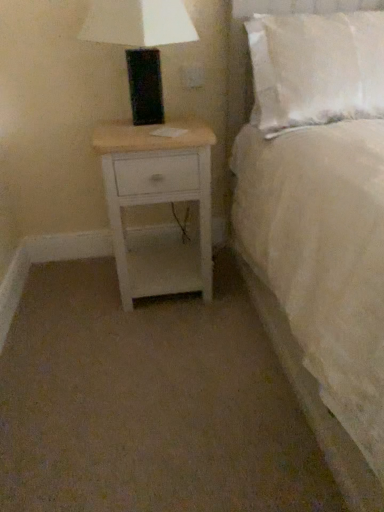
Identify the location of white soft pillow at upper right. Image resolution: width=384 pixels, height=512 pixels. coord(316,68).

You are a GUI agent. You are given a task and a screenshot of the screen. Output one action in this format:
    pyautogui.click(x=<x>, y=<y>)
    Task: Click on the white soft bed at upper right
    
    Given the screenshot: What is the action you would take?
    pyautogui.click(x=267, y=262)

Locate an element on the screen. This screenshot has width=384, height=512. white wood nightstand at lower left is located at coordinates (158, 202).

Which is more to the left, white plastic outlet at upper center or matte black lamp at upper left?

Positioned to the left is matte black lamp at upper left.

Considering the positions of point (182, 72) and point (100, 16), is point (182, 72) closer or farther from the camera than point (100, 16)?

Point (182, 72).

From the image's perspective, which is above, white plastic outlet at upper center or matte black lamp at upper left?

white plastic outlet at upper center is shown above in the image.

Is matte black lamp at upper left at the back of white plastic outlet at upper center?

That's not correct — white plastic outlet at upper center is not looking away from matte black lamp at upper left.

Are white wood nightstand at lower left and white soft pillow at upper right making contact?

No, white wood nightstand at lower left is not next to white soft pillow at upper right.

Between white wood nightstand at lower left and white soft pillow at upper right, which one has smaller size?

Smaller between the two is white wood nightstand at lower left.

Is white wood nightstand at lower left turned away from white soft pillow at upper right?

No, white soft pillow at upper right is not at the back of white wood nightstand at lower left.

From a real-world perspective, is white wood nightstand at lower left beneath white soft pillow at upper right?

Correct, in the physical world, white wood nightstand at lower left is lower than white soft pillow at upper right.

Considering the relative sizes of white soft pillow at upper right and white soft bed at upper right in the image provided, is white soft pillow at upper right bigger than white soft bed at upper right?

Actually, white soft pillow at upper right might be smaller than white soft bed at upper right.

From the image's perspective, relative to white soft bed at upper right, is white soft pillow at upper right above or below?

white soft pillow at upper right is above white soft bed at upper right.

Considering the relative positions of white soft pillow at upper right and white soft bed at upper right in the image provided, is white soft pillow at upper right to the left or to the right of white soft bed at upper right?

Clearly, white soft pillow at upper right is on the right of white soft bed at upper right in the image.

Who is taller, white soft pillow at upper right or white soft bed at upper right?

white soft bed at upper right.

Considering the sizes of objects white soft bed at upper right and white wood nightstand at lower left in the image provided, who is thinner, white soft bed at upper right or white wood nightstand at lower left?

white wood nightstand at lower left is thinner.

From a real-world perspective, is white soft bed at upper right positioned over white wood nightstand at lower left based on gravity?

Yes, from a real-world perspective, white soft bed at upper right is on top of white wood nightstand at lower left.

This screenshot has width=384, height=512. In order to click on nightstand above the white soft bed at upper right (from the image's perspective) in this screenshot , I will do `click(158, 202)`.

Does point (177, 254) appear closer or farther from the camera than point (197, 81)?

Point (177, 254) is farther from the camera than point (197, 81).

How different are the orientations of white wood nightstand at lower left and white plastic outlet at upper center in degrees?

They differ by 0.0276 degrees in their facing directions.

Which is behind, white wood nightstand at lower left or white plastic outlet at upper center?

Positioned behind is white plastic outlet at upper center.

Does white soft bed at upper right touch matte black lamp at upper left?

white soft bed at upper right and matte black lamp at upper left are not in contact.

From a real-world perspective, which is physically above, white soft bed at upper right or matte black lamp at upper left?

matte black lamp at upper left is physically above.

Between white soft bed at upper right and matte black lamp at upper left, which one has less height?

Standing shorter between the two is matte black lamp at upper left.

How much distance is there between white soft bed at upper right and matte black lamp at upper left?

white soft bed at upper right and matte black lamp at upper left are 21.83 inches apart.

Which of these two, white soft bed at upper right or white soft pillow at upper right, is smaller?

white soft pillow at upper right.

Which is correct: white soft bed at upper right is inside white soft pillow at upper right, or outside of it?

white soft bed at upper right lies outside white soft pillow at upper right.

From a real-world perspective, is white soft bed at upper right above or below white soft pillow at upper right?

Clearly, from a real-world perspective, white soft bed at upper right is below white soft pillow at upper right.

Locate an element on the screen. The height and width of the screenshot is (512, 384). electric outlet behind the matte black lamp at upper left is located at coordinates (192, 76).

The image size is (384, 512). I want to click on nightstand that is under the white soft pillow at upper right (from a real-world perspective), so click(158, 202).

Estimate the real-world distances between objects in this image. Which object is further from white plastic outlet at upper center, white soft bed at upper right or matte black lamp at upper left?

white soft bed at upper right is positioned further to the anchor white plastic outlet at upper center.

From the image, which object appears to be farther from white plastic outlet at upper center, white soft bed at upper right or white wood nightstand at lower left?

white soft bed at upper right is positioned further to the anchor white plastic outlet at upper center.

Considering their positions, is white soft pillow at upper right positioned further to white plastic outlet at upper center than matte black lamp at upper left?

white soft pillow at upper right is further to white plastic outlet at upper center.

Looking at the image, which one is located closer to matte black lamp at upper left, white soft bed at upper right or white soft pillow at upper right?

Based on the image, white soft pillow at upper right appears to be nearer to matte black lamp at upper left.

Considering their positions, is matte black lamp at upper left positioned closer to white wood nightstand at lower left than white plastic outlet at upper center?

Based on the image, matte black lamp at upper left appears to be nearer to white wood nightstand at lower left.

Looking at the image, which one is located closer to white soft bed at upper right, white soft pillow at upper right or white plastic outlet at upper center?

white soft pillow at upper right lies closer to white soft bed at upper right than the other object.

When comparing their distances from white wood nightstand at lower left, does white soft pillow at upper right or matte black lamp at upper left seem further?

white soft pillow at upper right is positioned further to the anchor white wood nightstand at lower left.

When comparing their distances from white soft pillow at upper right, does white plastic outlet at upper center or matte black lamp at upper left seem further?

white plastic outlet at upper center is further to white soft pillow at upper right.

At what (x,y) coordinates should I click in order to perform the action: click on table lamp positioned between white soft bed at upper right and white plastic outlet at upper center from near to far. Please return your answer as a coordinate pair (x, y). Looking at the image, I should click on (141, 45).

The image size is (384, 512). What are the coordinates of `electric outlet between white wood nightstand at lower left and white soft pillow at upper right from left to right` in the screenshot? It's located at (192, 76).

The height and width of the screenshot is (512, 384). I want to click on electric outlet between matte black lamp at upper left and white soft pillow at upper right, so click(x=192, y=76).

This screenshot has width=384, height=512. Find the location of `table lamp between white plastic outlet at upper center and white wood nightstand at lower left in the up-down direction`. table lamp between white plastic outlet at upper center and white wood nightstand at lower left in the up-down direction is located at coordinates (141, 45).